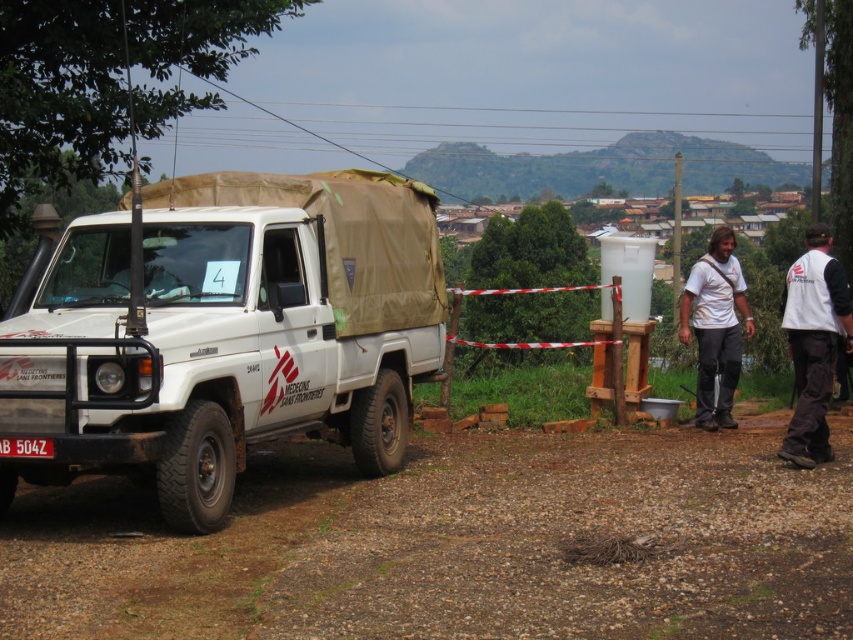
You are standing at the point closest to the vehicle in the image. Which of the two points, point (451,476) or point (733,298), is closer to you?

Point (451,476) is in front of point (733,298), so it is closer to you.